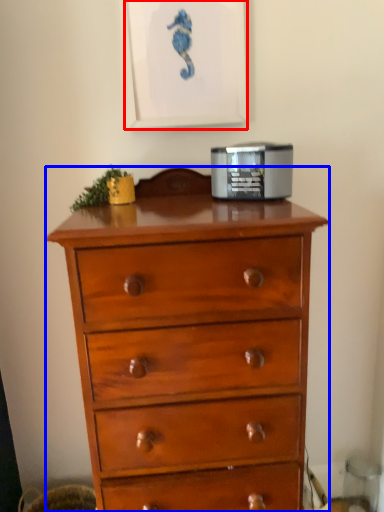
Question: Which of the following is the farthest to the observer, picture frame (highlighted by a red box) or chest of drawers (highlighted by a blue box)?

Choices:
 (A) picture frame
 (B) chest of drawers

Answer: (A)